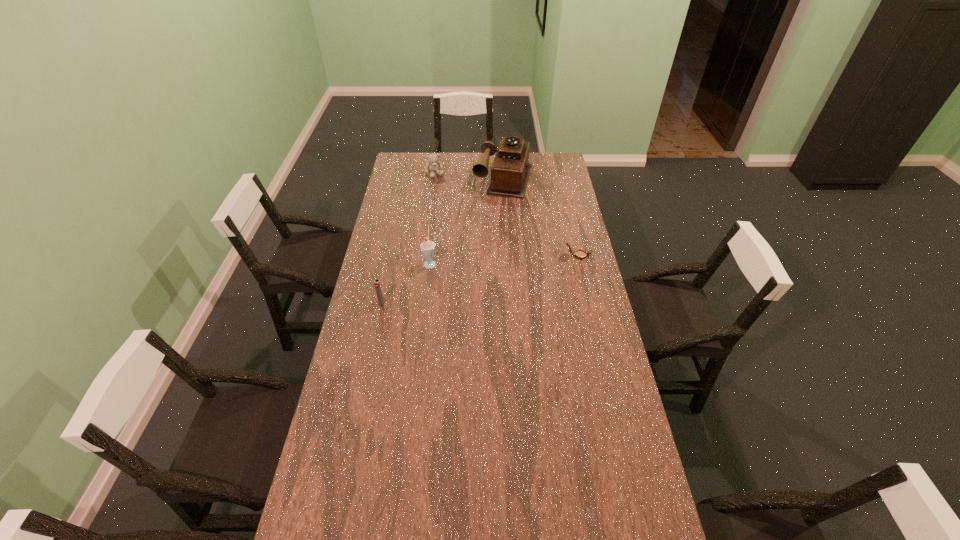
You are a GUI agent. You are given a task and a screenshot of the screen. Output one action in this format:
    pyautogui.click(x=<x>, y=<y>)
    Task: Click on the nearest object
    This screenshot has height=540, width=960.
    Given the screenshot: What is the action you would take?
    pyautogui.click(x=377, y=285)

Locate an element on the screen. The width and height of the screenshot is (960, 540). igniter is located at coordinates (x=377, y=285).

Identify the location of the shortest object. Image resolution: width=960 pixels, height=540 pixels. (579, 254).

Identify the location of compass. (579, 254).

This screenshot has height=540, width=960. In order to click on the second tallest object in this screenshot , I will do `click(427, 247)`.

Where is `the fourth object from left to right`? the fourth object from left to right is located at coordinates (510, 171).

What are the coordinates of `the tallest object` in the screenshot? It's located at (510, 171).

Find the location of a particular element. The image size is (960, 540). teddy bear is located at coordinates tap(432, 166).

The image size is (960, 540). Find the location of `free space located 0.090m on the right of the igniter`. free space located 0.090m on the right of the igniter is located at coordinates (407, 303).

Identify the location of vacant region located on the straw side of the milkshake. Image resolution: width=960 pixels, height=540 pixels. tap(480, 278).